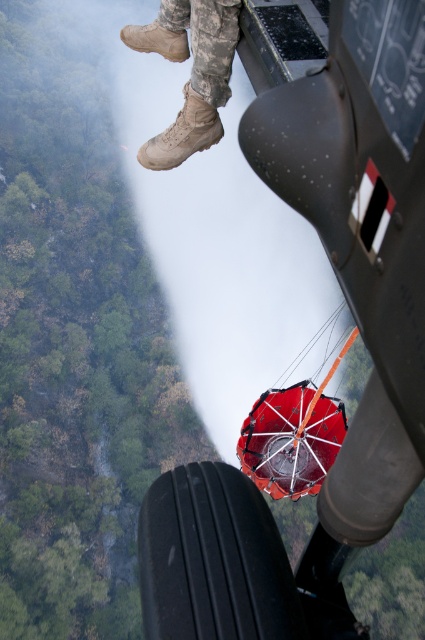
Question: Which point is closer to the camera taking this photo?

Choices:
 (A) (215, 10)
 (B) (402, 445)

Answer: (B)

Question: Which point appears closest to the camera in this image?

Choices:
 (A) (345, 22)
 (B) (197, 17)

Answer: (A)

Question: Is matte black aircraft at center further to the viewer compared to tan suede boots at upper center?

Choices:
 (A) no
 (B) yes

Answer: (A)

Question: Is matte black aircraft at center closer to the viewer compared to tan suede boots at upper center?

Choices:
 (A) yes
 (B) no

Answer: (A)

Question: Is matte black aircraft at center wider than tan suede boots at upper center?

Choices:
 (A) yes
 (B) no

Answer: (B)